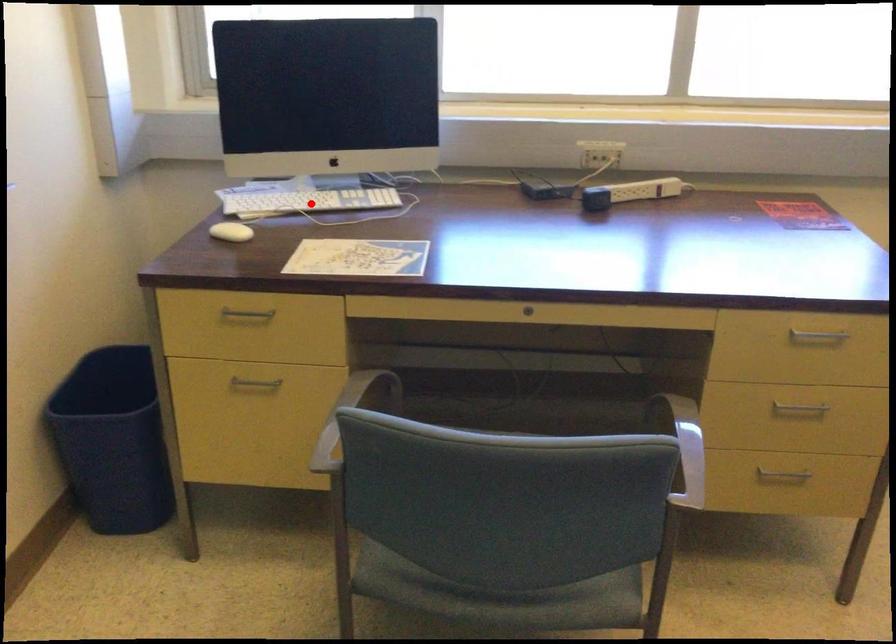
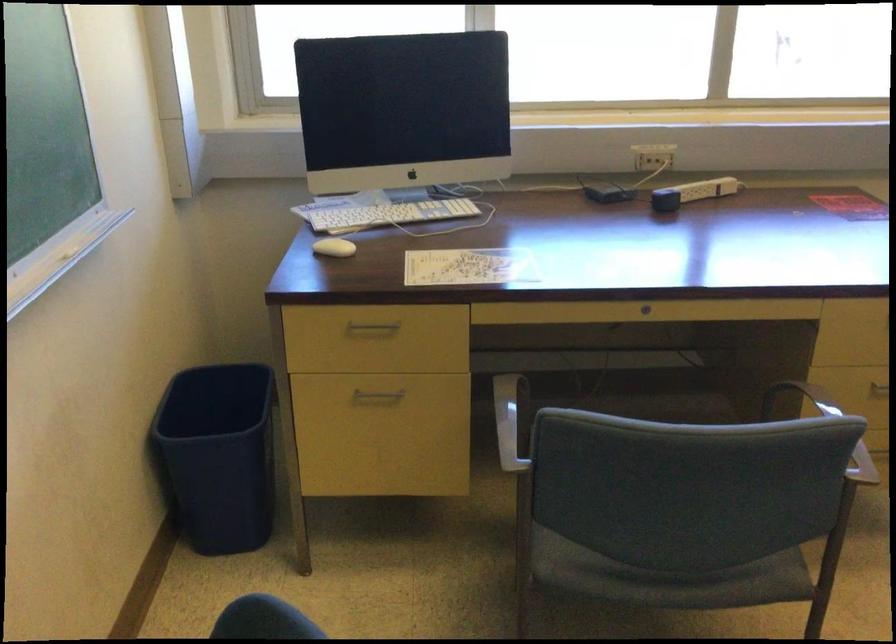
The point at the highlighted location is marked in the first image. Where is the corresponding point in the second image?

(389, 214)